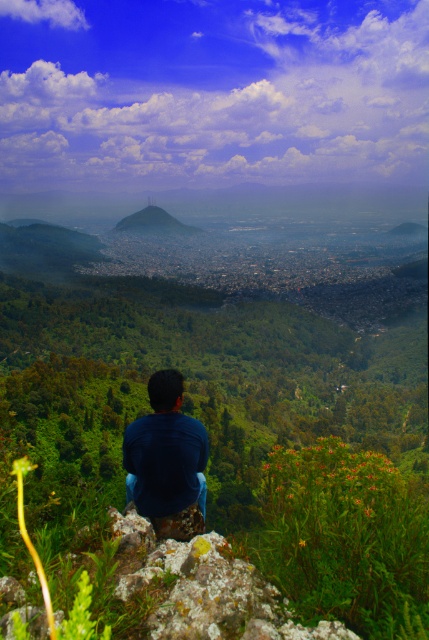
Question: Among these points, which one is nearest to the camera?

Choices:
 (A) (121, 221)
 (B) (184, 435)

Answer: (B)

Question: Is dark blue shirt at center further to the viewer compared to green mossy hill at center?

Choices:
 (A) yes
 (B) no

Answer: (B)

Question: Can you confirm if dark blue shirt at center is smaller than green mossy hill at center?

Choices:
 (A) yes
 (B) no

Answer: (A)

Question: Is dark blue shirt at center below green mossy hill at center?

Choices:
 (A) yes
 (B) no

Answer: (A)